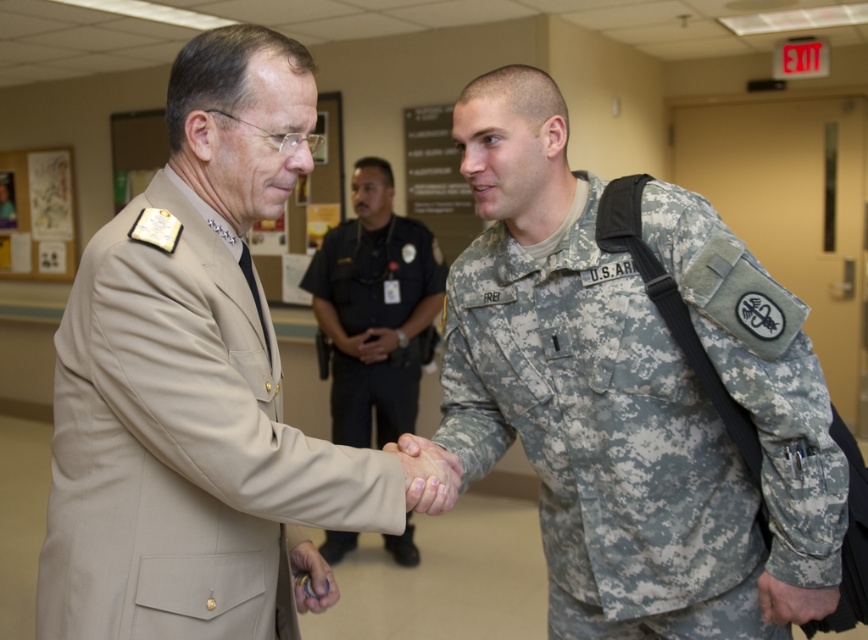
Between tan uniform at center and metallic ring at center, which one has less height?

Result: With less height is metallic ring at center.

Between tan uniform at center and metallic ring at center, which one is positioned lower?

Positioned lower is metallic ring at center.

Describe the element at coordinates (373, 308) in the screenshot. I see `tan uniform at center` at that location.

Find the location of `tan uniform at center`. tan uniform at center is located at coordinates (373, 308).

Locate an element on the screen. This screenshot has height=640, width=868. tan fabric uniform at center is located at coordinates (182, 445).

Who is shorter, tan fabric uniform at center or camouflage fabric hand at center?

camouflage fabric hand at center

Is point (106, 445) positioned behind point (426, 486)?

No, it is in front of (426, 486).

Where is `tan fabric uniform at center`? The height and width of the screenshot is (640, 868). tan fabric uniform at center is located at coordinates (182, 445).

Who is more distant from viewer, (776, 534) or (250, 593)?

The point (776, 534) is behind.

Looking at this image, which of these two, camouflage fabric uniform at center or tan fabric uniform at center, stands taller?

With more height is camouflage fabric uniform at center.

Is point (741, 625) positioned behind point (266, 353)?

That is True.

This screenshot has height=640, width=868. I want to click on camouflage fabric uniform at center, so click(643, 412).